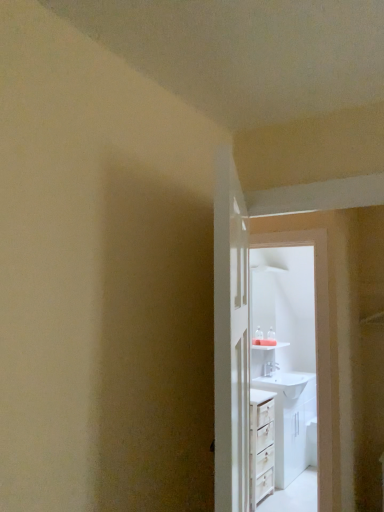
Question: Is white glossy sink at center shorter than white glossy door at center?

Choices:
 (A) yes
 (B) no

Answer: (A)

Question: Is white glossy door at center a part of white glossy sink at center?

Choices:
 (A) no
 (B) yes

Answer: (A)

Question: Considering the relative sizes of white glossy sink at center and white glossy door at center in the image provided, is white glossy sink at center smaller than white glossy door at center?

Choices:
 (A) no
 (B) yes

Answer: (A)

Question: Is white glossy sink at center to the right of white glossy door at center from the viewer's perspective?

Choices:
 (A) yes
 (B) no

Answer: (A)

Question: Considering the relative sizes of white glossy sink at center and white glossy door at center in the image provided, is white glossy sink at center taller than white glossy door at center?

Choices:
 (A) yes
 (B) no

Answer: (B)

Question: Relative to white glossy sink at center, is white glossy sink at upper center in front or behind?

Choices:
 (A) behind
 (B) front

Answer: (B)

Question: Would you say white glossy sink at upper center is to the left or to the right of white glossy sink at center in the picture?

Choices:
 (A) right
 (B) left

Answer: (B)

Question: Is white glossy sink at upper center inside the boundaries of white glossy sink at center, or outside?

Choices:
 (A) inside
 (B) outside

Answer: (B)

Question: In terms of width, does white glossy sink at upper center look wider or thinner when compared to white glossy sink at center?

Choices:
 (A) wide
 (B) thin

Answer: (B)

Question: Considering the positions of point (307, 454) and point (235, 307), is point (307, 454) closer or farther from the camera than point (235, 307)?

Choices:
 (A) farther
 (B) closer

Answer: (A)

Question: From a real-world perspective, relative to white glossy door at center, is white glossy sink at center vertically above or below?

Choices:
 (A) below
 (B) above

Answer: (A)

Question: Considering their positions, is white glossy sink at center located in front of or behind white glossy door at center?

Choices:
 (A) front
 (B) behind

Answer: (B)

Question: From the image's perspective, is white glossy sink at center positioned above or below white glossy door at center?

Choices:
 (A) above
 (B) below

Answer: (B)

Question: In terms of size, does white glossy sink at upper center appear bigger or smaller than white glossy door at center?

Choices:
 (A) small
 (B) big

Answer: (A)

Question: From their relative heights in the image, would you say white glossy sink at upper center is taller or shorter than white glossy door at center?

Choices:
 (A) tall
 (B) short

Answer: (A)